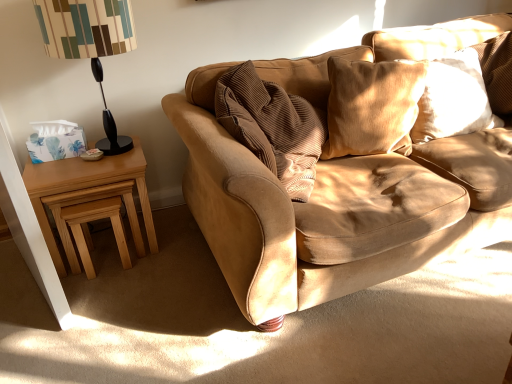
Image resolution: width=512 pixels, height=384 pixels. Identify the location of light brown wood nesting tables at left. (86, 187).

What are the coordinates of `light brown wooden stool at lower left` in the screenshot? It's located at (94, 220).

At what (x,y) coordinates should I click in order to perform the action: click on suede cushion at upper right, marked as the first pillow in a left-to-right arrangement. Please return your answer as a coordinate pair (x, y). Image resolution: width=512 pixels, height=384 pixels. Looking at the image, I should click on (372, 106).

Is suede cushion at upper right, the second pillow when ordered from right to left, far from light brown wood nesting tables at left?

suede cushion at upper right, the second pillow when ordered from right to left, is far away from light brown wood nesting tables at left.

Does suede cushion at upper right, the second pillow when ordered from right to left, turn towards light brown wood nesting tables at left?

No, suede cushion at upper right, the second pillow when ordered from right to left, is not facing towards light brown wood nesting tables at left.

Does point (386, 84) come in front of point (115, 177)?

No, it is not.

Is suede cushion at upper right, the second pillow when ordered from right to left, positioned beyond the bounds of light brown wood nesting tables at left?

suede cushion at upper right, the second pillow when ordered from right to left, lies outside light brown wood nesting tables at left's area.

From the image's perspective, is black plastic table lamp at left over light brown wood nesting tables at left?

Yes, from the image's perspective, black plastic table lamp at left is on top of light brown wood nesting tables at left.

Considering the positions of objects black plastic table lamp at left and light brown wood nesting tables at left in the image provided, who is more to the left, black plastic table lamp at left or light brown wood nesting tables at left?

light brown wood nesting tables at left is more to the left.

Is black plastic table lamp at left shorter than light brown wood nesting tables at left?

No.

In the scene shown: Looking at their sizes, would you say light brown wooden stool at lower left is wider or thinner than light brown wood nesting tables at left?

Considering their sizes, light brown wooden stool at lower left looks slimmer than light brown wood nesting tables at left.

Is light brown wooden stool at lower left positioned far away from light brown wood nesting tables at left?

That's not correct — light brown wooden stool at lower left is a little close to light brown wood nesting tables at left.

From the image's perspective, which is below, light brown wooden stool at lower left or light brown wood nesting tables at left?

light brown wooden stool at lower left.

This screenshot has width=512, height=384. Find the location of `pillow in front of the white satin pillow at upper right, the second pillow from the left`. pillow in front of the white satin pillow at upper right, the second pillow from the left is located at coordinates (372, 106).

Is white satin pillow at upper right, the second pillow from the left, looking in the opposite direction of suede cushion at upper right, marked as the first pillow in a left-to-right arrangement?

No, suede cushion at upper right, marked as the first pillow in a left-to-right arrangement, is not at the back of white satin pillow at upper right, the second pillow from the left.

Which is correct: white satin pillow at upper right, the second pillow from the left, is inside suede cushion at upper right, marked as the first pillow in a left-to-right arrangement, or outside of it?

white satin pillow at upper right, the second pillow from the left, is not inside suede cushion at upper right, marked as the first pillow in a left-to-right arrangement, it's outside.

From the image's perspective, is white satin pillow at upper right, the second pillow from the left, located above or below suede cushion at upper right, marked as the first pillow in a left-to-right arrangement?

From the image's perspective, white satin pillow at upper right, the second pillow from the left, appears above suede cushion at upper right, marked as the first pillow in a left-to-right arrangement.

In the scene shown: Is suede cushion at upper right, the second pillow when ordered from right to left, oriented towards white satin pillow at upper right, positioned as the first pillow in right-to-left order?

No, suede cushion at upper right, the second pillow when ordered from right to left, is not turned towards white satin pillow at upper right, positioned as the first pillow in right-to-left order.

Looking at their sizes, would you say suede cushion at upper right, the second pillow when ordered from right to left, is wider or thinner than white satin pillow at upper right, positioned as the first pillow in right-to-left order?

Considering their sizes, suede cushion at upper right, the second pillow when ordered from right to left, looks slimmer than white satin pillow at upper right, positioned as the first pillow in right-to-left order.

Is suede cushion at upper right, marked as the first pillow in a left-to-right arrangement, bigger than white satin pillow at upper right, the second pillow from the left?

Incorrect, suede cushion at upper right, marked as the first pillow in a left-to-right arrangement, is not larger than white satin pillow at upper right, the second pillow from the left.

Is suede cushion at upper right, the second pillow when ordered from right to left, in contact with white satin pillow at upper right, positioned as the first pillow in right-to-left order?

No.

Can you confirm if light brown wood nesting tables at left is smaller than suede cushion at upper right, the second pillow when ordered from right to left?

No, light brown wood nesting tables at left is not smaller than suede cushion at upper right, the second pillow when ordered from right to left.

Which is more to the left, light brown wood nesting tables at left or suede cushion at upper right, marked as the first pillow in a left-to-right arrangement?

From the viewer's perspective, light brown wood nesting tables at left appears more on the left side.

Does point (74, 182) come behind point (364, 93)?

No.

Which object is more forward, light brown wood nesting tables at left or suede cushion at upper right, marked as the first pillow in a left-to-right arrangement?

suede cushion at upper right, marked as the first pillow in a left-to-right arrangement, is in front.

Is light brown wooden stool at lower left taller than black plastic table lamp at left?

No, light brown wooden stool at lower left is not taller than black plastic table lamp at left.

Is light brown wooden stool at lower left not close to black plastic table lamp at left?

They are positioned close to each other.

Does light brown wooden stool at lower left appear on the right side of black plastic table lamp at left?

No, light brown wooden stool at lower left is not to the right of black plastic table lamp at left.

Which is behind, light brown wooden stool at lower left or black plastic table lamp at left?

light brown wooden stool at lower left is further from the camera.

The image size is (512, 384). Identify the location of the 2nd pillow directly above the light brown wood nesting tables at left (from a real-world perspective). (372, 106).

At what (x,y) coordinates should I click in order to perform the action: click on nightstand that is below the black plastic table lamp at left (from the image's perspective). Please return your answer as a coordinate pair (x, y). Looking at the image, I should click on (86, 187).

Estimate the real-world distances between objects in this image. Which object is closer to black plastic table lamp at left, light brown wooden stool at lower left or suede cushion at upper right, marked as the first pillow in a left-to-right arrangement?

light brown wooden stool at lower left.

Considering their positions, is white satin pillow at upper right, the second pillow from the left, positioned further to black plastic table lamp at left than light brown wooden stool at lower left?

white satin pillow at upper right, the second pillow from the left, is further to black plastic table lamp at left.

Considering their positions, is light brown wooden stool at lower left positioned further to suede cushion at upper right, the second pillow when ordered from right to left, than white satin pillow at upper right, the second pillow from the left?

light brown wooden stool at lower left is further to suede cushion at upper right, the second pillow when ordered from right to left.

From the image, which object appears to be nearer to suede cushion at upper right, marked as the first pillow in a left-to-right arrangement, light brown wooden stool at lower left or black plastic table lamp at left?

Based on the image, black plastic table lamp at left appears to be nearer to suede cushion at upper right, marked as the first pillow in a left-to-right arrangement.

Looking at the image, which one is located further to light brown wood nesting tables at left, white satin pillow at upper right, the second pillow from the left, or black plastic table lamp at left?

Among the two, white satin pillow at upper right, the second pillow from the left, is located further to light brown wood nesting tables at left.

Estimate the real-world distances between objects in this image. Which object is further from white satin pillow at upper right, the second pillow from the left, light brown wood nesting tables at left or light brown wooden stool at lower left?

light brown wooden stool at lower left is positioned further to the anchor white satin pillow at upper right, the second pillow from the left.

From the image, which object appears to be nearer to light brown wood nesting tables at left, black plastic table lamp at left or suede cushion at upper right, marked as the first pillow in a left-to-right arrangement?

black plastic table lamp at left is closer to light brown wood nesting tables at left.

Based on the photo, which object lies further to the anchor point light brown wood nesting tables at left, light brown wooden stool at lower left or suede cushion at upper right, marked as the first pillow in a left-to-right arrangement?

suede cushion at upper right, marked as the first pillow in a left-to-right arrangement, is positioned further to the anchor light brown wood nesting tables at left.

Identify the location of table lamp between light brown wood nesting tables at left and suede cushion at upper right, marked as the first pillow in a left-to-right arrangement, from left to right. This screenshot has height=384, width=512. coord(89,44).

Locate an element on the screen. stool between light brown wood nesting tables at left and white satin pillow at upper right, the second pillow from the left, from left to right is located at coordinates (94, 220).

The width and height of the screenshot is (512, 384). Identify the location of pillow between light brown wood nesting tables at left and white satin pillow at upper right, the second pillow from the left. (372, 106).

The height and width of the screenshot is (384, 512). In order to click on nightstand between black plastic table lamp at left and light brown wooden stool at lower left in the up-down direction in this screenshot , I will do `click(86, 187)`.